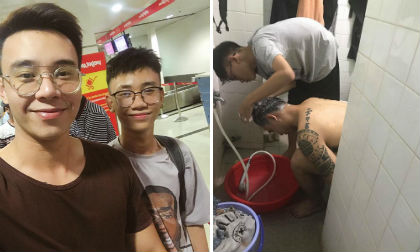
This screenshot has height=252, width=420. Identify the location of store floor. (196, 148).